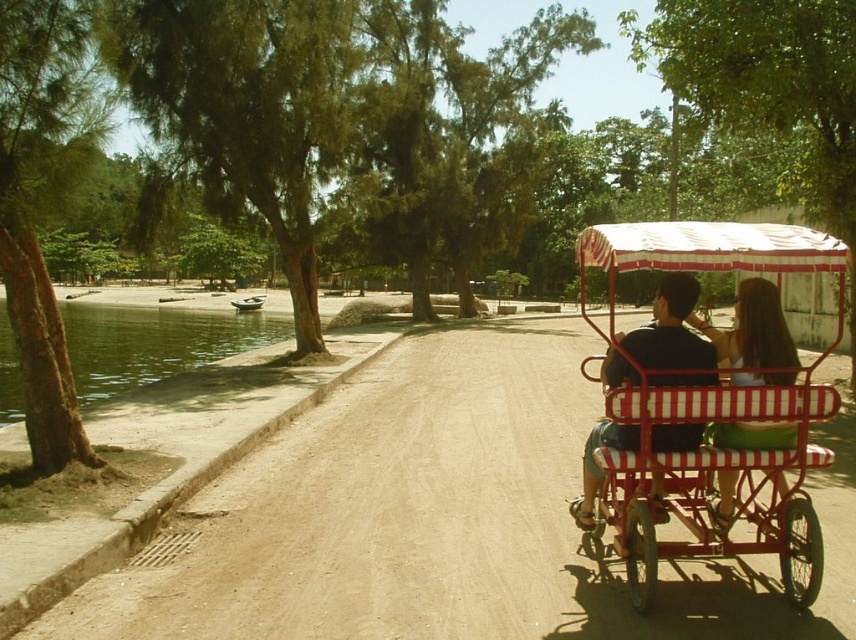
Looking at this image, you are a photographer standing on the dirt path and want to capture both the clear water at lower left and the matte white dress at center in a single photo. Which object will appear closer to the camera in the photo?

The clear water at lower left will appear closer to the camera in the photo because it is further to the viewer than the matte white dress at center, meaning it is positioned nearer to the photographer.

You are standing at point (785,484) and want to walk towards the red rickshaw. Is the point (712,269) in your path?

Yes, point (712,269) is in front of point (785,484), so it is in your path towards the red rickshaw.